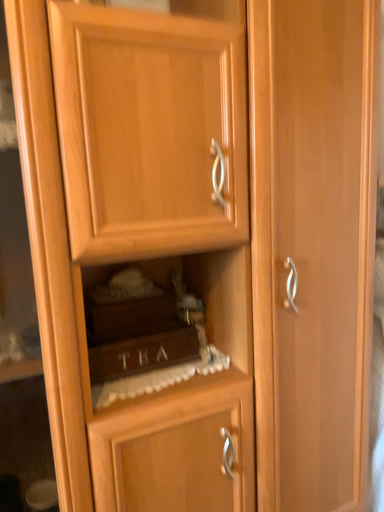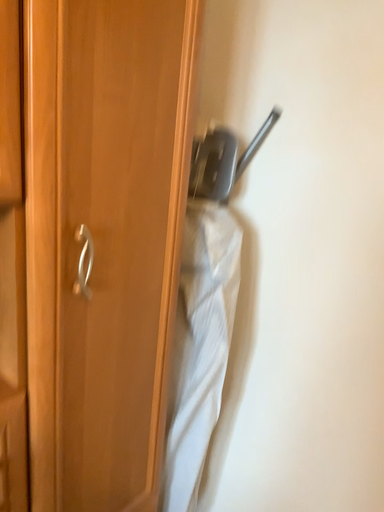
Question: Which way did the camera rotate in the video?

Choices:
 (A) rotated downward
 (B) rotated upward

Answer: (A)